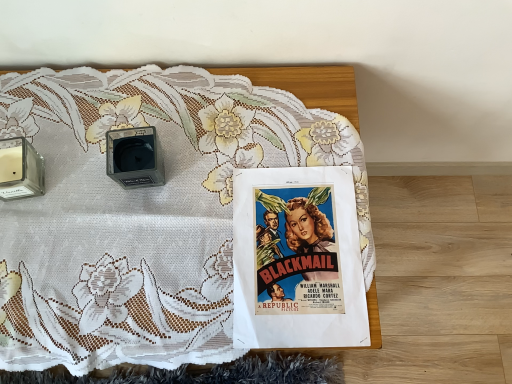
The image size is (512, 384). Identify the location of vacant area on the back side of transparent glass candle at left, acting as the first speaker starting from the left. (46, 103).